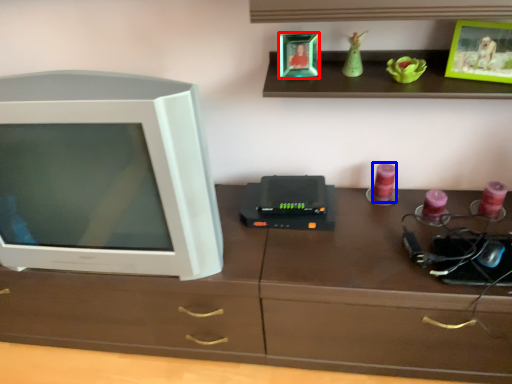
Question: Among these objects, which one is nearest to the camera, picture frame (highlighted by a red box) or candle (highlighted by a blue box)?

Choices:
 (A) picture frame
 (B) candle

Answer: (A)